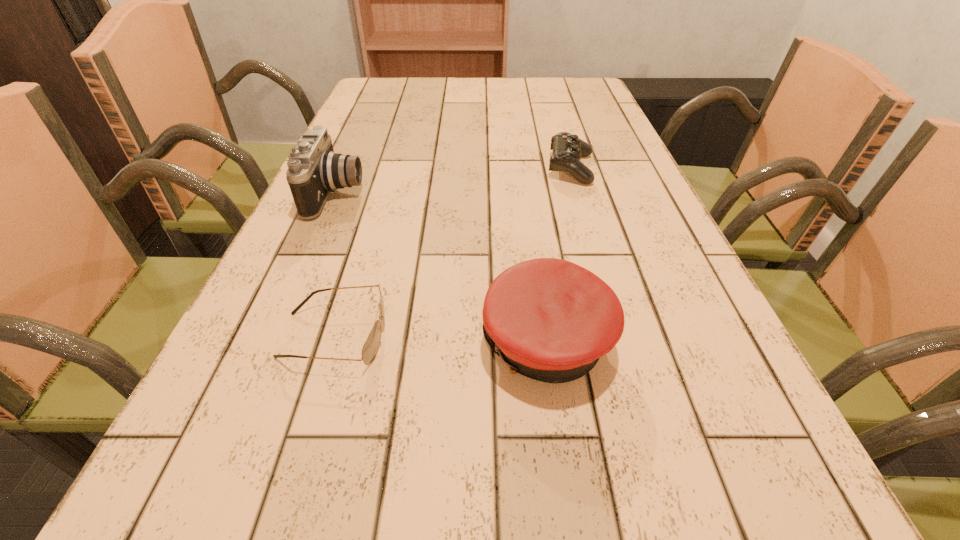
I want to click on the tallest object, so click(x=314, y=170).

Identify the location of the third shortest object. [548, 319].

In order to click on control in this screenshot , I will do `click(568, 149)`.

Find the location of a particular element. The width and height of the screenshot is (960, 540). the shortest object is located at coordinates (370, 348).

Find the location of `free space located 0.320m on the front-facing side of the camera`. free space located 0.320m on the front-facing side of the camera is located at coordinates (507, 194).

This screenshot has height=540, width=960. What are the coordinates of `free space located 0.140m at the front of the third shortest object where the visor is located` in the screenshot? It's located at (390, 343).

In order to click on free space located 0.320m at the front of the third shortest object where the visor is located in this screenshot , I will do `click(272, 343)`.

You are a GUI agent. You are given a task and a screenshot of the screen. Output one action in this format:
    pyautogui.click(x=<x>, y=<y>)
    Task: Click on the blank space located at the front of the third shortest object where the visor is located
    The width and height of the screenshot is (960, 540).
    Given the screenshot: What is the action you would take?
    pos(410,343)

Find the location of a particular element. Image resolution: width=960 pixels, height=540 pixels. free spot located 0.290m on the front of the control is located at coordinates (602, 274).

Where is `vacant region located on the front-facing side of the shortest object`? Image resolution: width=960 pixels, height=540 pixels. vacant region located on the front-facing side of the shortest object is located at coordinates (540, 335).